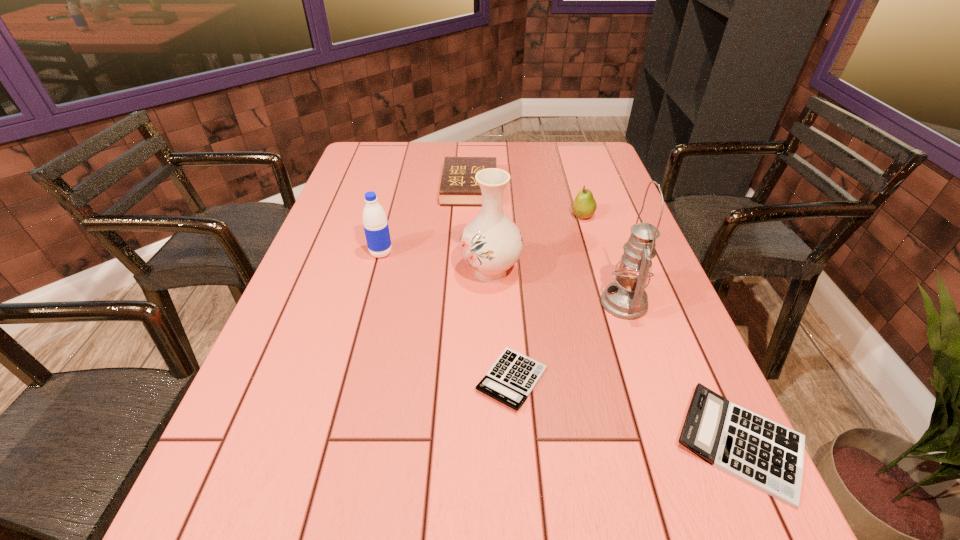
Find the location of `the left calculator`. the left calculator is located at coordinates (511, 379).

The width and height of the screenshot is (960, 540). Find the location of `the shortest object`. the shortest object is located at coordinates (511, 379).

At what (x,y) coordinates should I click in order to perform the action: click on the second shortest object. Please return your answer as a coordinate pair (x, y). This screenshot has height=540, width=960. Looking at the image, I should click on (769, 456).

Where is `the right calculator`? This screenshot has width=960, height=540. the right calculator is located at coordinates (769, 456).

What are the coordinates of `the third shortest object` in the screenshot? It's located at (458, 187).

The height and width of the screenshot is (540, 960). Find the location of `the farthest object`. the farthest object is located at coordinates (458, 187).

The height and width of the screenshot is (540, 960). What are the coordinates of `the fourth tallest object` in the screenshot? It's located at pyautogui.click(x=584, y=205).

Image resolution: width=960 pixels, height=540 pixels. In order to click on pear in this screenshot , I will do `click(584, 205)`.

Where is `oil lamp`? This screenshot has width=960, height=540. oil lamp is located at coordinates (625, 298).

Where is `water bottle`? This screenshot has width=960, height=540. water bottle is located at coordinates (375, 223).